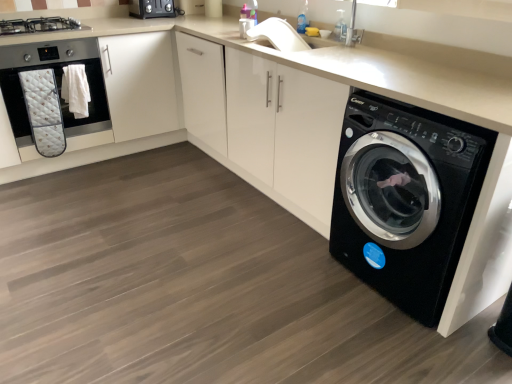
The height and width of the screenshot is (384, 512). In order to click on free space above satin black stove at upper left (from a real-world perspective) in this screenshot , I will do `click(41, 16)`.